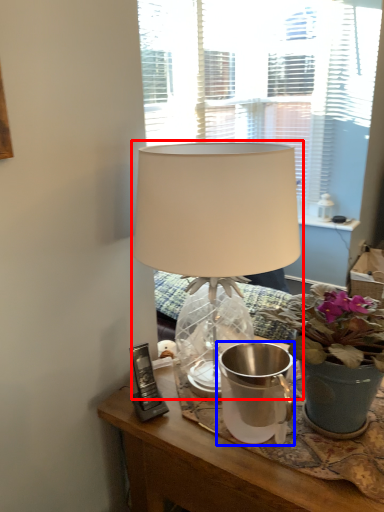
Question: Among these objects, which one is nearest to the camera, lamp (highlighted by a red box) or watering can (highlighted by a blue box)?

Choices:
 (A) lamp
 (B) watering can

Answer: (A)